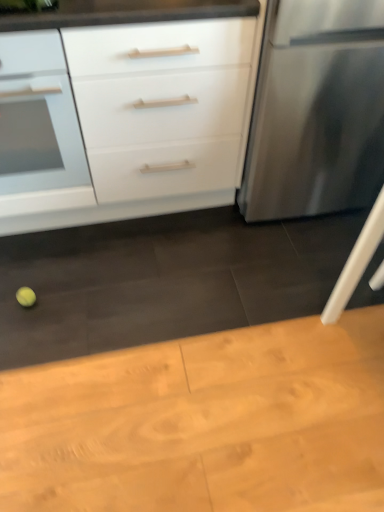
Question: Can we say yellow matte tennis ball at lower left lies outside white matte drawer at upper left, which is the 2th drawer in back-to-front order?

Choices:
 (A) yes
 (B) no

Answer: (A)

Question: From the image's perspective, is yellow matte tennis ball at lower left on white matte drawer at upper left, which is the 2th drawer in back-to-front order?

Choices:
 (A) yes
 (B) no

Answer: (B)

Question: Is yellow matte tennis ball at lower left positioned before white matte drawer at upper left, the 1th drawer in the front-to-back sequence?

Choices:
 (A) yes
 (B) no

Answer: (B)

Question: From a real-world perspective, is yellow matte tennis ball at lower left under white matte drawer at upper left, the 1th drawer in the front-to-back sequence?

Choices:
 (A) yes
 (B) no

Answer: (A)

Question: Is yellow matte tennis ball at lower left bigger than white matte drawer at upper left, which is the 2th drawer in back-to-front order?

Choices:
 (A) yes
 (B) no

Answer: (B)

Question: Would you say wooden table at lower center is to the left or to the right of white matte drawer at upper left, which is the 2th drawer in back-to-front order, in the picture?

Choices:
 (A) right
 (B) left

Answer: (A)

Question: From a real-world perspective, is wooden table at lower center above or below white matte drawer at upper left, which is the 2th drawer in back-to-front order?

Choices:
 (A) above
 (B) below

Answer: (B)

Question: Looking at their shapes, would you say wooden table at lower center is wider or thinner than white matte drawer at upper left, which is the 2th drawer in back-to-front order?

Choices:
 (A) wide
 (B) thin

Answer: (A)

Question: In the image, is wooden table at lower center positioned in front of or behind white matte drawer at upper left, which is the 2th drawer in back-to-front order?

Choices:
 (A) front
 (B) behind

Answer: (A)

Question: Relative to wooden table at lower center, is white matte drawer at left, which is the second drawer from front to back, in front or behind?

Choices:
 (A) front
 (B) behind

Answer: (B)

Question: Is white matte drawer at left, which ranks as the first drawer in back-to-front order, taller or shorter than wooden table at lower center?

Choices:
 (A) tall
 (B) short

Answer: (A)

Question: Does point (18, 212) appear closer or farther from the camera than point (104, 431)?

Choices:
 (A) closer
 (B) farther

Answer: (B)

Question: Considering the positions of white matte drawer at left, which ranks as the first drawer in back-to-front order, and wooden table at lower center in the image, is white matte drawer at left, which ranks as the first drawer in back-to-front order, wider or thinner than wooden table at lower center?

Choices:
 (A) thin
 (B) wide

Answer: (A)

Question: From the image's perspective, is yellow matte tennis ball at lower left located above or below white matte drawer at upper left, which is the 2th drawer in back-to-front order?

Choices:
 (A) above
 (B) below

Answer: (B)

Question: Do you think yellow matte tennis ball at lower left is within white matte drawer at upper left, which is the 2th drawer in back-to-front order, or outside of it?

Choices:
 (A) inside
 (B) outside

Answer: (B)